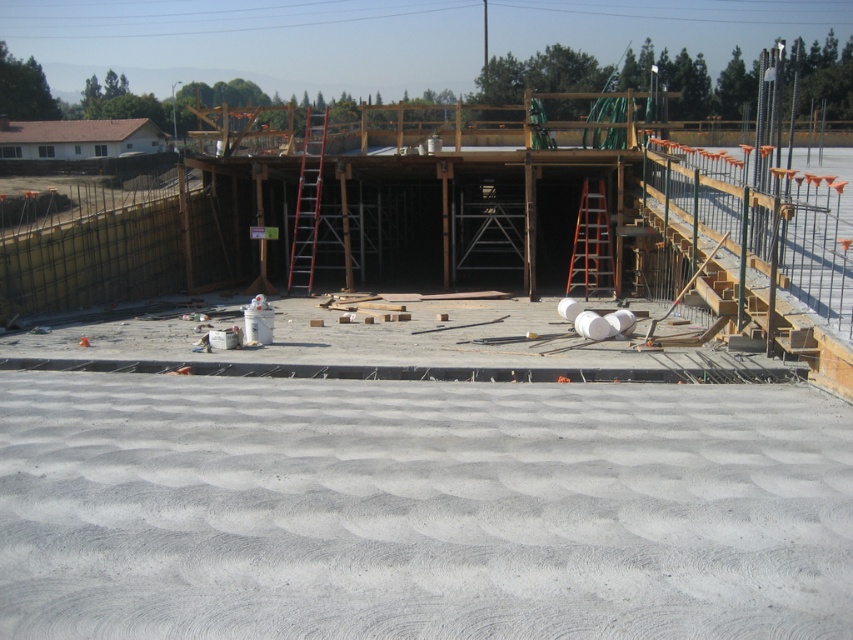
Which is above, red metal ladder at center or orange metallic ladder at center?

red metal ladder at center is higher up.

Does red metal ladder at center appear on the left side of orange metallic ladder at center?

Yes, red metal ladder at center is to the left of orange metallic ladder at center.

Who is more distant from viewer, (318, 186) or (579, 273)?

Positioned behind is point (579, 273).

Where is `red metal ladder at center`? red metal ladder at center is located at coordinates (306, 202).

Is smooth concrete floor at center smaller than red metal ladder at center?

Yes.

Measure the distance between smooth concrete floor at center and camera.

The distance of smooth concrete floor at center from camera is 3.31 meters.

This screenshot has height=640, width=853. What are the coordinates of `smooth concrete floor at center` in the screenshot? It's located at (421, 508).

Is smooth concrete floor at center below orange metallic ladder at center?

Yes, smooth concrete floor at center is below orange metallic ladder at center.

Is smooth concrete floor at center bigger than orange metallic ladder at center?

No.

What do you see at coordinates (421, 508) in the screenshot? I see `smooth concrete floor at center` at bounding box center [421, 508].

Locate an element on the screen. smooth concrete floor at center is located at coordinates (421, 508).